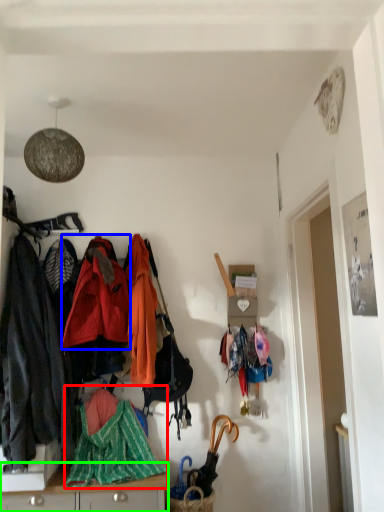
Question: Which object is the closest to the blanket (highlighted by a red box)? Choose among these: jacket (highlighted by a blue box) or cabinetry (highlighted by a green box).

Choices:
 (A) jacket
 (B) cabinetry

Answer: (B)